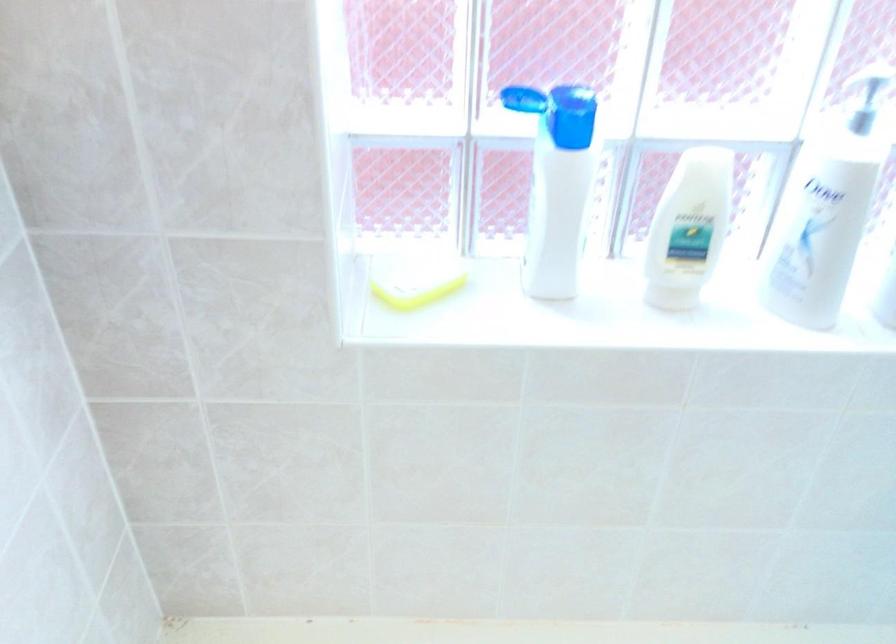
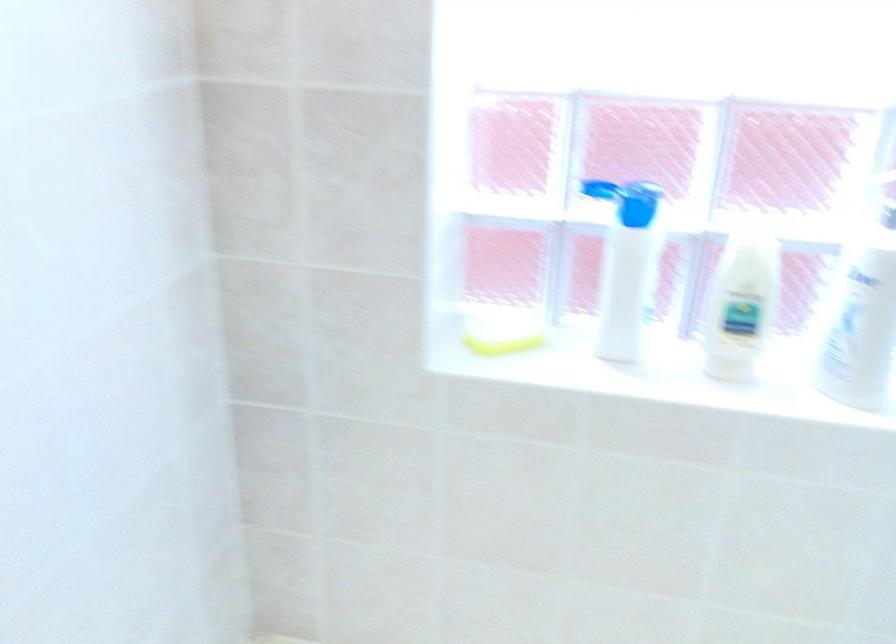
Where in the second image is the point corresponding to (x=821, y=242) from the first image?

(860, 323)